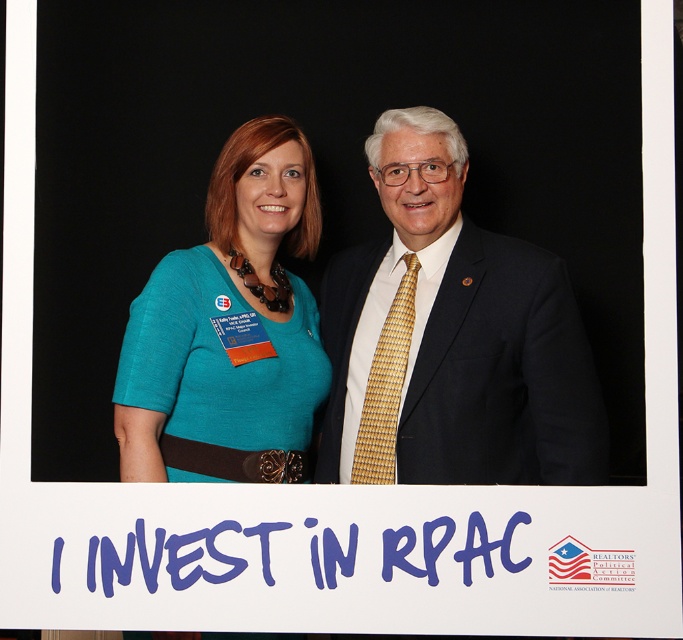
Question: Considering the real-world distances, which object is farthest from the teal fabric dress at center?

Choices:
 (A) gold woven tie at center
 (B) matte black suit at center

Answer: (A)

Question: Can you confirm if matte black suit at center is positioned below teal fabric dress at center?

Choices:
 (A) yes
 (B) no

Answer: (A)

Question: Which object is farther from the camera taking this photo?

Choices:
 (A) gold woven tie at center
 (B) matte black suit at center

Answer: (A)

Question: Can you confirm if matte black suit at center is bigger than teal fabric dress at center?

Choices:
 (A) no
 (B) yes

Answer: (B)

Question: Does teal fabric dress at center lie behind gold woven tie at center?

Choices:
 (A) yes
 (B) no

Answer: (B)

Question: Which of the following is the farthest from the observer?

Choices:
 (A) pos(408,328)
 (B) pos(370,410)

Answer: (A)